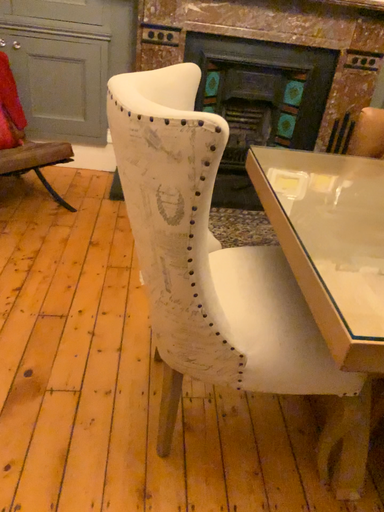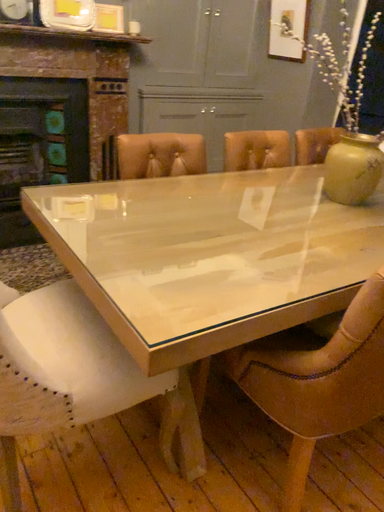
Question: How did the camera likely rotate when shooting the video?

Choices:
 (A) rotated right
 (B) rotated left

Answer: (A)